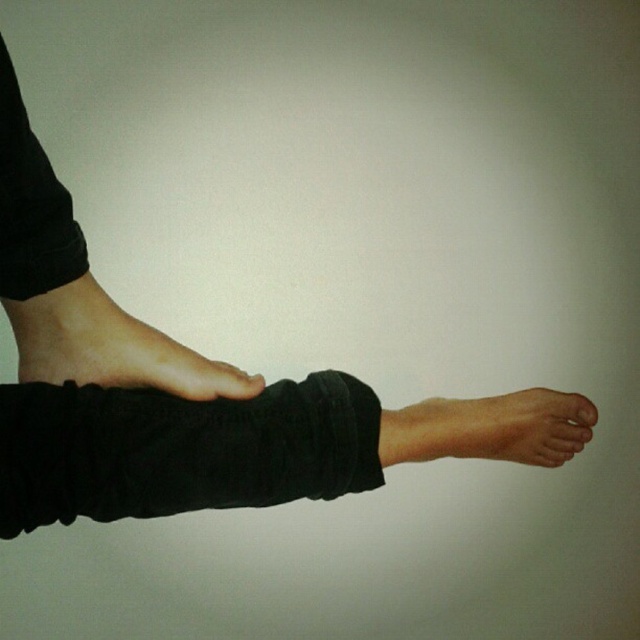
You are a photographer setting up a shoot and need to arrange two subjects in the frame. The subjects are the black matte leg at left and the smooth skin foot at lower left. According to the scene description, which subject is closer to the camera?

The black matte leg at left is closer to the camera because it is in front of the smooth skin foot at lower left.